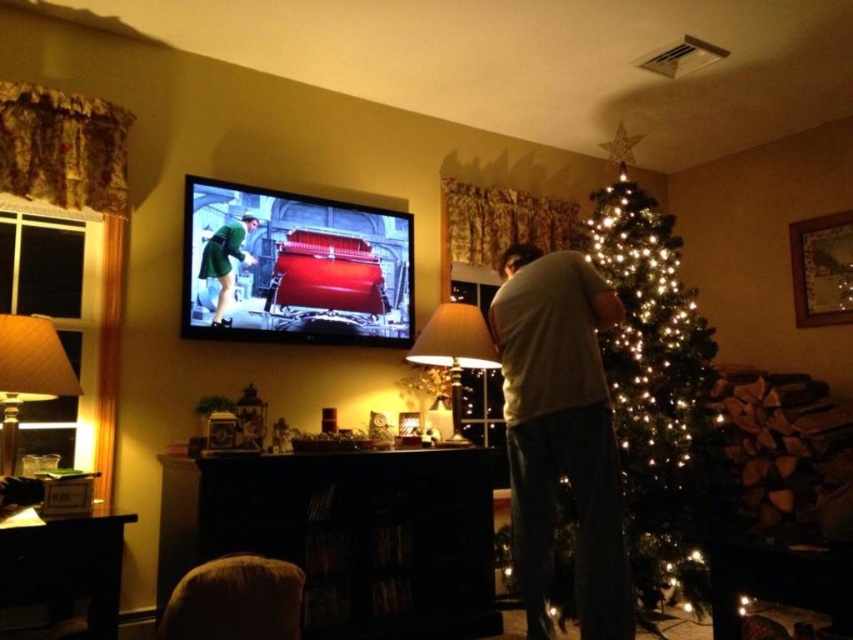
You are a delivery person who just arrived at the house. You need to place a package that is 1 meter long on the floor between the dark wood entertainment center at lower center and the white cotton shirt at right. Is there enough space for the package?

The distance between the dark wood entertainment center at lower center and the white cotton shirt at right is 79.32 centimeters. Since the package is 1 meter long, which is longer than the available space, the package cannot be placed there without overlapping the objects.

You are a guest in this living room and want to place a small gift box on the tallest object between the matte white lampshade at center and the green matte dress at upper left. Which object should you choose?

The matte white lampshade at center is taller than the green matte dress at upper left, so you should place the small gift box on the matte white lampshade at center.

You are a delivery person who needs to place a tall package that is 1.8 meters in height. You see the dark wood entertainment center at lower center and the quilted fabric lampshade at left. Which object can the package be placed next to without exceeding its height?

The dark wood entertainment center at lower center is much taller than the quilted fabric lampshade at left, so the package can be placed next to the dark wood entertainment center at lower center as it can accommodate the height of 1.8 meters.